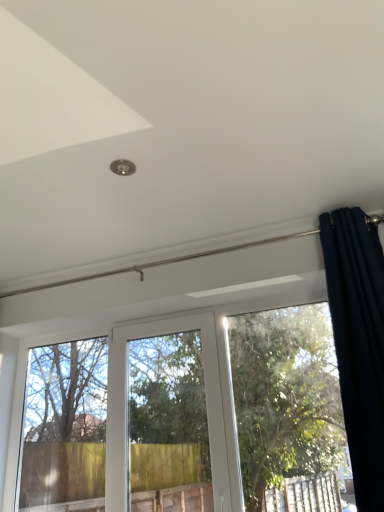
Describe the element at coordinates (358, 343) in the screenshot. I see `dark blue velvet curtain at upper right` at that location.

Where is `dark blue velvet curtain at upper right`? dark blue velvet curtain at upper right is located at coordinates (358, 343).

What do you see at coordinates (285, 397) in the screenshot? I see `green leafy tree at lower center` at bounding box center [285, 397].

This screenshot has height=512, width=384. I want to click on green leafy tree at lower center, so click(285, 397).

What is the approximate width of green leafy tree at lower center?

It is 2.94 inches.

Identify the location of dark blue velvet curtain at upper right. (358, 343).

Which is more to the right, green leafy tree at lower center or dark blue velvet curtain at upper right?

A: dark blue velvet curtain at upper right is more to the right.

Considering the relative positions of green leafy tree at lower center and dark blue velvet curtain at upper right in the image provided, is green leafy tree at lower center in front of dark blue velvet curtain at upper right?

No, the depth of green leafy tree at lower center is greater than that of dark blue velvet curtain at upper right.

Which point is more forward, (184,467) or (370,409)?

Point (370,409)

From the image's perspective, who appears lower, green leafy tree at lower center or dark blue velvet curtain at upper right?

green leafy tree at lower center, from the image's perspective.

From a real-world perspective, which is physically above, green leafy tree at lower center or dark blue velvet curtain at upper right?

dark blue velvet curtain at upper right.

Does green leafy tree at lower center have a lesser width compared to dark blue velvet curtain at upper right?

Indeed, green leafy tree at lower center has a lesser width compared to dark blue velvet curtain at upper right.

Does green leafy tree at lower center have a lesser height compared to dark blue velvet curtain at upper right?

Yes.

Who is bigger, green leafy tree at lower center or dark blue velvet curtain at upper right?

With larger size is green leafy tree at lower center.

Is green leafy tree at lower center not inside dark blue velvet curtain at upper right?

Yes, green leafy tree at lower center is not within dark blue velvet curtain at upper right.

Are green leafy tree at lower center and dark blue velvet curtain at upper right beside each other?

green leafy tree at lower center and dark blue velvet curtain at upper right are clearly separated.

Is green leafy tree at lower center aimed at dark blue velvet curtain at upper right?

Yes, green leafy tree at lower center is aimed at dark blue velvet curtain at upper right.

How distant is green leafy tree at lower center from dark blue velvet curtain at upper right?

3.27 meters.

The image size is (384, 512). In the image, there is a green leafy tree at lower center. Find the location of `curtain above it (from the image's perspective)`. curtain above it (from the image's perspective) is located at coordinates pos(358,343).

Considering the relative positions of dark blue velvet curtain at upper right and green leafy tree at lower center in the image provided, is dark blue velvet curtain at upper right to the right of green leafy tree at lower center from the viewer's perspective?

Correct, you'll find dark blue velvet curtain at upper right to the right of green leafy tree at lower center.

Considering the positions of objects dark blue velvet curtain at upper right and green leafy tree at lower center in the image provided, who is behind, dark blue velvet curtain at upper right or green leafy tree at lower center?

green leafy tree at lower center.

Is point (330, 256) closer or farther from the camera than point (134, 456)?

Point (330, 256) is closer to the camera than point (134, 456).

From the image's perspective, is dark blue velvet curtain at upper right located above green leafy tree at lower center?

Yes, from the image's perspective, dark blue velvet curtain at upper right is on top of green leafy tree at lower center.

From a real-world perspective, is dark blue velvet curtain at upper right located beneath green leafy tree at lower center?

Incorrect, from a real-world perspective, dark blue velvet curtain at upper right is higher than green leafy tree at lower center.

Considering the sizes of dark blue velvet curtain at upper right and green leafy tree at lower center in the image, is dark blue velvet curtain at upper right wider or thinner than green leafy tree at lower center?

Clearly, dark blue velvet curtain at upper right has more width compared to green leafy tree at lower center.

Does dark blue velvet curtain at upper right have a lesser height compared to green leafy tree at lower center?

Incorrect, the height of dark blue velvet curtain at upper right does not fall short of that of green leafy tree at lower center.

Based on their sizes in the image, would you say dark blue velvet curtain at upper right is bigger or smaller than green leafy tree at lower center?

dark blue velvet curtain at upper right is smaller than green leafy tree at lower center.

Can green leafy tree at lower center be found inside dark blue velvet curtain at upper right?

No, dark blue velvet curtain at upper right does not contain green leafy tree at lower center.

Is dark blue velvet curtain at upper right not near green leafy tree at lower center?

That's right, there is a large distance between dark blue velvet curtain at upper right and green leafy tree at lower center.

Is dark blue velvet curtain at upper right aimed at green leafy tree at lower center?

No, dark blue velvet curtain at upper right is not turned towards green leafy tree at lower center.

How different are the orientations of dark blue velvet curtain at upper right and green leafy tree at lower center in degrees?

They differ by 0.0109 degrees in their facing directions.

Locate an element on the screen. curtain in front of the green leafy tree at lower center is located at coordinates (358, 343).

Where is `tree on the left of dark blue velvet curtain at upper right`? This screenshot has height=512, width=384. tree on the left of dark blue velvet curtain at upper right is located at coordinates (285, 397).

Find the location of a particular element. The height and width of the screenshot is (512, 384). curtain on the right of green leafy tree at lower center is located at coordinates (358, 343).